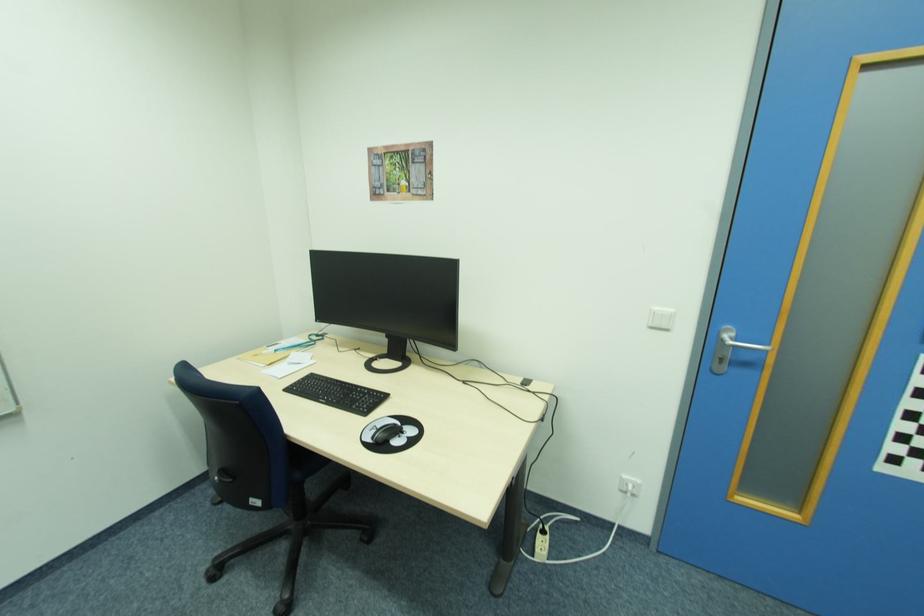
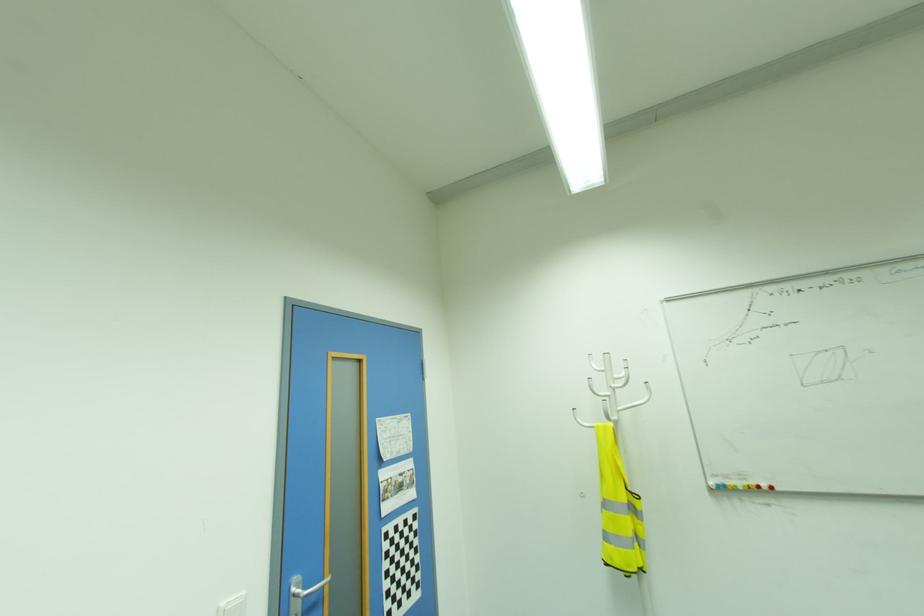
Question: The images are taken continuously from a first-person perspective. In which direction is your viewpoint rotating?

Choices:
 (A) Left
 (B) Right
 (C) Up
 (D) Down

Answer: (B)